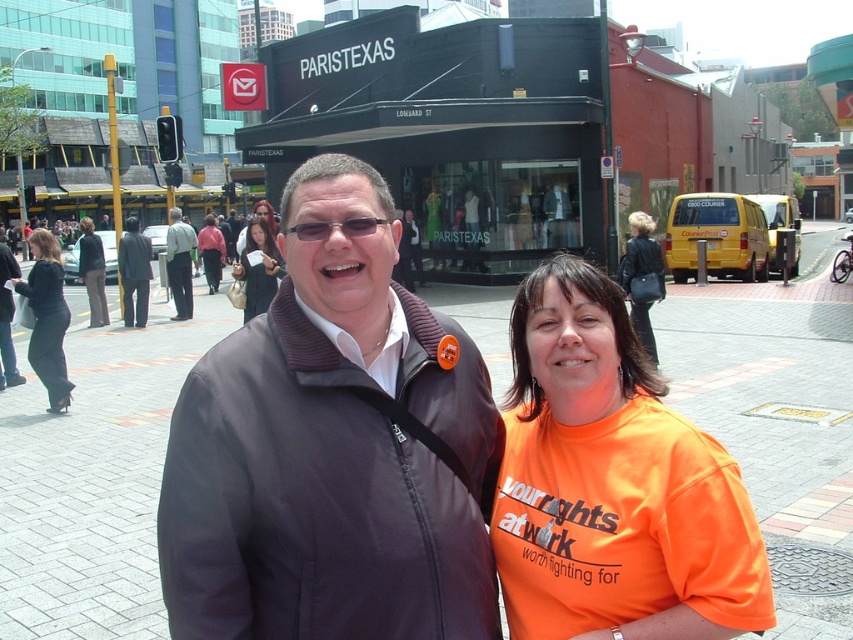
Question: Considering the relative positions of matte brown sweater at center and matte black jacket at center in the image provided, where is matte brown sweater at center located with respect to matte black jacket at center?

Choices:
 (A) right
 (B) left

Answer: (A)

Question: Is matte brown sweater at center smaller than dark gray suit at center?

Choices:
 (A) no
 (B) yes

Answer: (B)

Question: Which of the following is the farthest from the observer?

Choices:
 (A) (268, 275)
 (B) (187, 260)
 (C) (384, 381)

Answer: (B)

Question: Based on their relative distances, which object is farther from the orange cotton t-shirt at center?

Choices:
 (A) matte brown sweater at center
 (B) black leather pants at left

Answer: (B)

Question: Which object appears closest to the camera in this image?

Choices:
 (A) matte black jacket at center
 (B) orange cotton t-shirt at center

Answer: (B)

Question: Does orange t-shirt at center appear on the right side of dark gray suit at center?

Choices:
 (A) no
 (B) yes

Answer: (B)